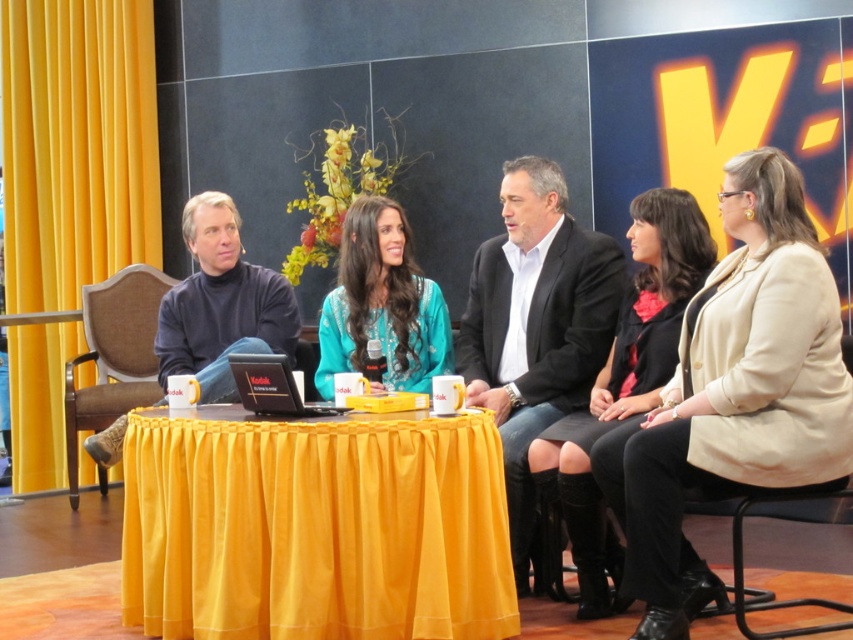
Question: Is black suit jacket at center positioned at the back of turquoise fabric dress at center?

Choices:
 (A) yes
 (B) no

Answer: (B)

Question: Does beige fabric jacket at right lie behind black suit jacket at center?

Choices:
 (A) no
 (B) yes

Answer: (A)

Question: Is yellow fabric table at center positioned before black leather skirt at center?

Choices:
 (A) yes
 (B) no

Answer: (A)

Question: Which object is farther from the camera taking this photo?

Choices:
 (A) brown fabric chair at left
 (B) black plastic laptop at center
 (C) black suit jacket at center

Answer: (A)

Question: Which of the following is the closest to the observer?

Choices:
 (A) beige fabric jacket at right
 (B) turquoise fabric dress at center

Answer: (A)

Question: Which is nearer to the dark blue turtleneck sweater at left?

Choices:
 (A) beige fabric jacket at right
 (B) yellow fabric table at center

Answer: (B)